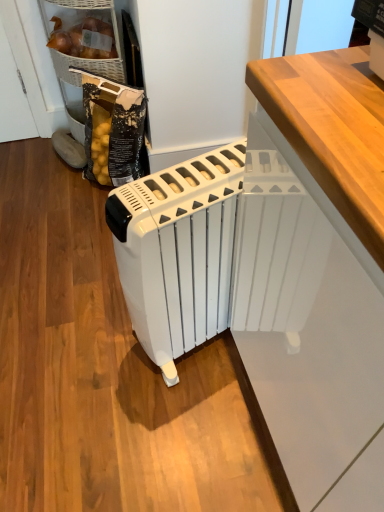
Question: In terms of height, does matte wicker basket at upper left, the 2th cabinetry when ordered from front to back, look taller or shorter compared to white plastic radiator at center?

Choices:
 (A) tall
 (B) short

Answer: (B)

Question: Relative to white plastic radiator at center, is matte wicker basket at upper left, arranged as the 1th cabinetry when viewed from the left, in front or behind?

Choices:
 (A) front
 (B) behind

Answer: (B)

Question: Estimate the real-world distances between objects in this image. Which object is farther from the white plastic radiator at center?

Choices:
 (A) matte wicker basket at upper left, the 2th cabinetry when ordered from front to back
 (B) white glossy radiator at center, which ranks as the 2th cabinetry in left-to-right order

Answer: (A)

Question: Estimate the real-world distances between objects in this image. Which object is farther from the white plastic radiator at center?

Choices:
 (A) matte wicker basket at upper left, the 2th cabinetry when ordered from front to back
 (B) white glossy radiator at center, the first cabinetry viewed from the front

Answer: (A)